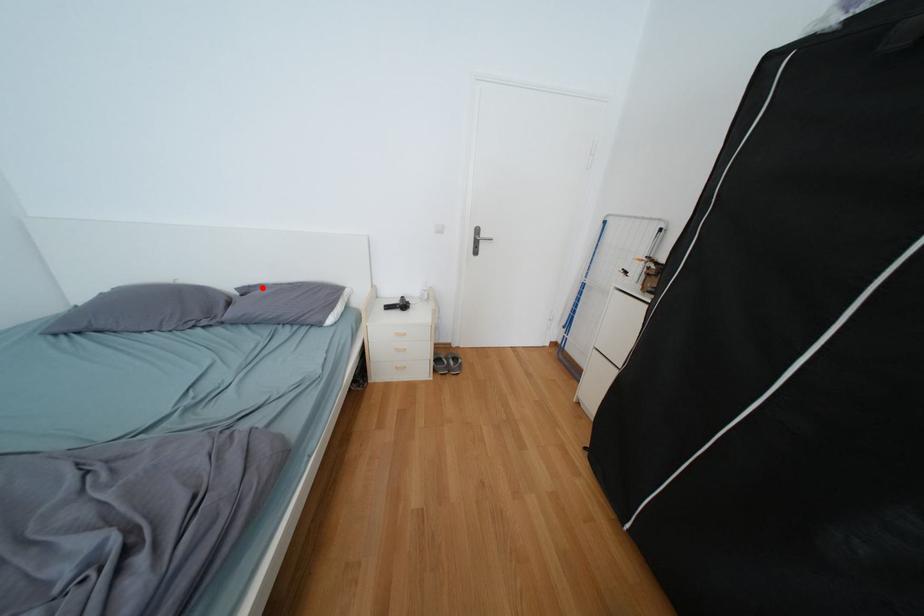
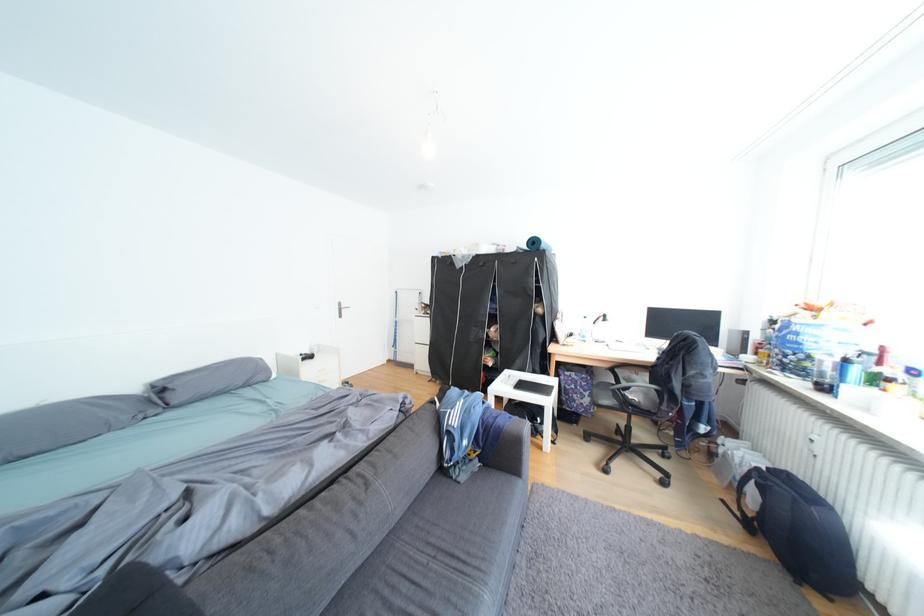
Find the pixel in the second image that matches the highlighted location in the first image.

(177, 379)